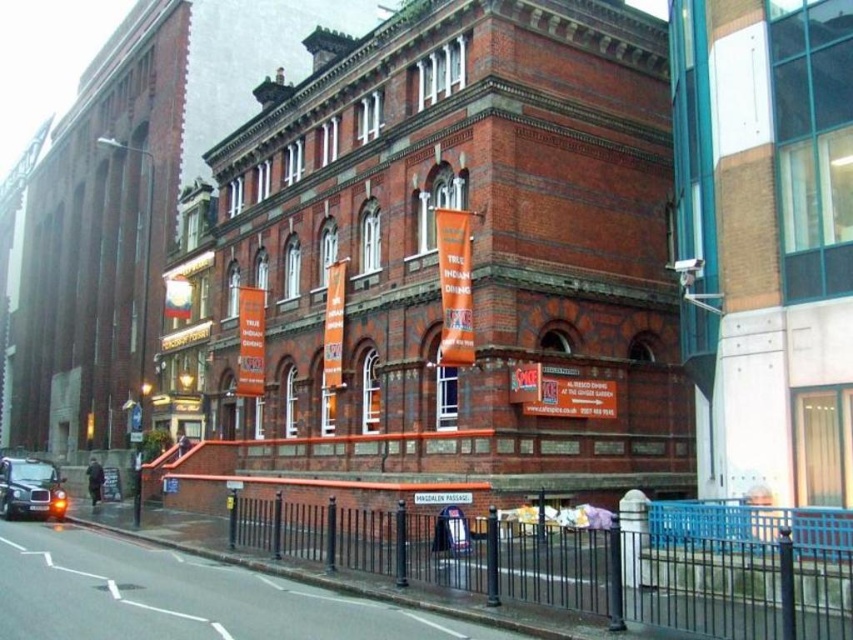
Question: Can you confirm if black metal fence at lower center is positioned above black matte taxi cab at lower left?

Choices:
 (A) yes
 (B) no

Answer: (A)

Question: Among these objects, which one is nearest to the camera?

Choices:
 (A) black metal fence at lower center
 (B) black matte taxi cab at lower left

Answer: (A)

Question: Is black metal fence at lower center smaller than black matte taxi cab at lower left?

Choices:
 (A) no
 (B) yes

Answer: (B)

Question: Does black metal fence at lower center appear over black matte taxi cab at lower left?

Choices:
 (A) no
 (B) yes

Answer: (B)